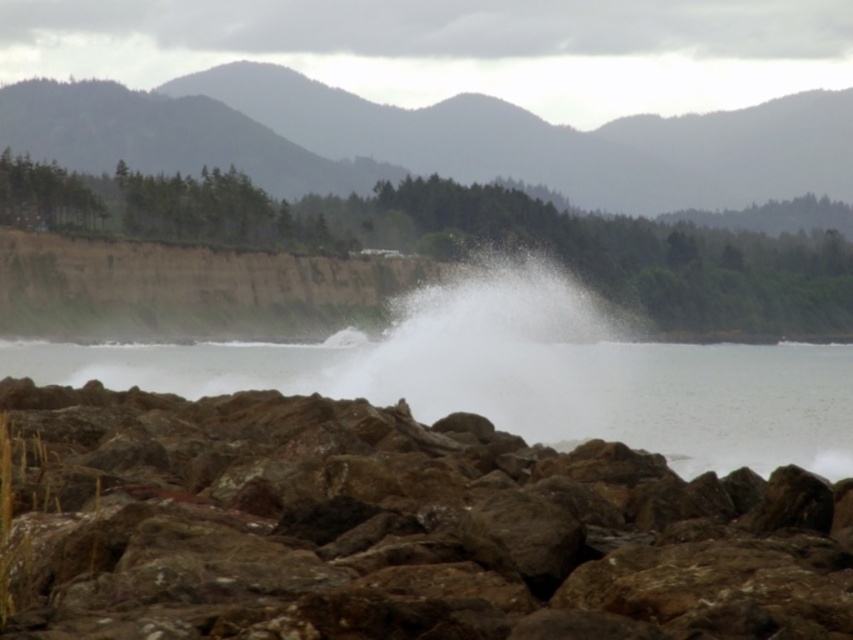
You are a photographer trying to capture the interaction between the brown rough rocks at lower center and the white frothy water at center. Based on their sizes, which one would you focus on to highlight the contrast between the stable and dynamic elements in the scene?

The white frothy water at center has a greater width than the brown rough rocks at lower center, so focusing on the white frothy water at center would better highlight the contrast between the stable rocks and the dynamic, wider water element.

You are a photographer trying to capture the height comparison between the brown rough rocks at lower center and the white frothy water at center. Based on the scene, which one is taller?

The white frothy water at center is taller than the brown rough rocks at lower center.

You are standing on a cliff overlooking the coast and want to place a small weatherproof camera at point (x=387, y=529) to capture the crashing waves. According to the scene description, what will the camera primarily capture?

The camera at point (x=387, y=529) will primarily capture brown rough rocks at lower center, as that is the object located at that coordinate.